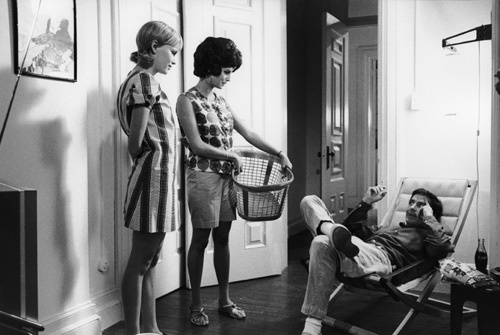
Locate an element on the screen. walls is located at coordinates (86, 131).